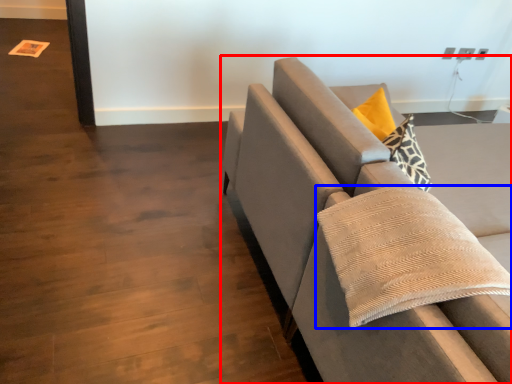
Question: Which object is closer to the camera taking this photo, studio couch (highlighted by a red box) or pillow (highlighted by a blue box)?

Choices:
 (A) studio couch
 (B) pillow

Answer: (B)